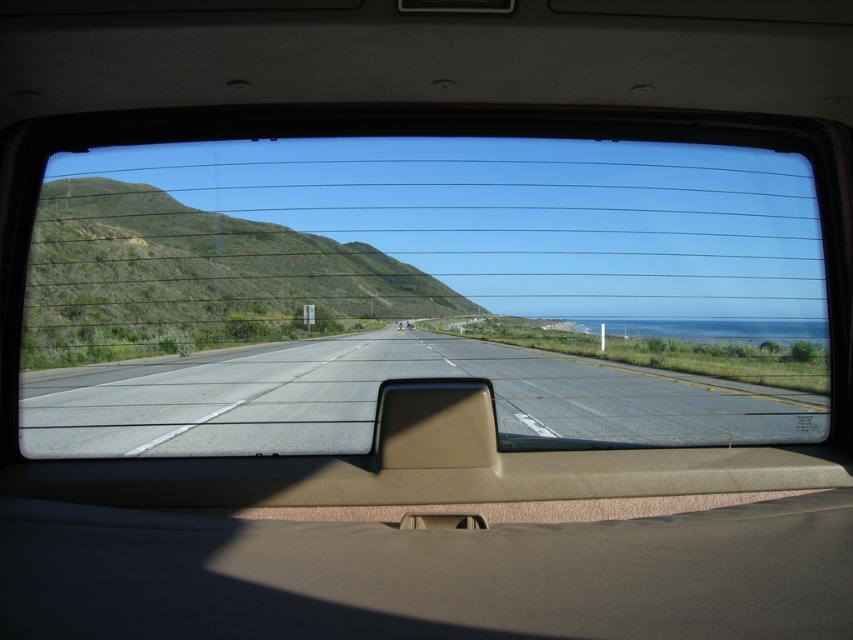
You are driving and need to check the distance between the asphalt road at center and the tan matte rearview mirror at center. Which one is closer to you?

The tan matte rearview mirror at center is closer to you since the asphalt road at center is further away.

You are sitting in the back seat of the vehicle and looking through the rear window. You notice two points marked on the window. The first point is at coordinates point (231, 225) and the second point is at coordinates point (381, 433). Which point is closer to you?

Point (231, 225) is further to the camera than point (381, 433), so the point closer to you is point (381, 433).